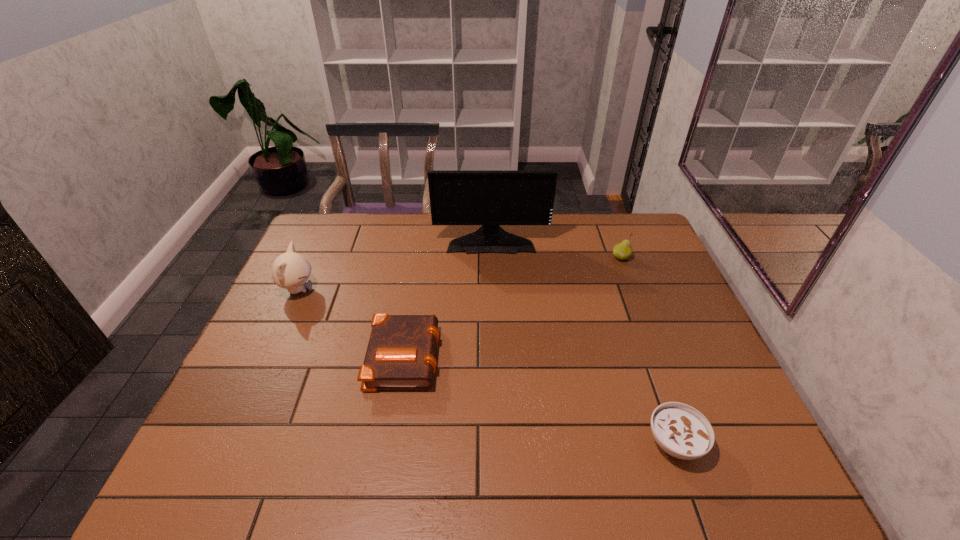
Find the location of `free space in the image that satisfies the following two spatial constraints: 1. on the screen side of the nearest object; 2. on the right side of the monitor`. free space in the image that satisfies the following two spatial constraints: 1. on the screen side of the nearest object; 2. on the right side of the monitor is located at coordinates (497, 442).

This screenshot has width=960, height=540. Find the location of `vacant space that satisfies the following two spatial constraints: 1. on the front side of the third tallest object; 2. on the spine side of the second nearest object`. vacant space that satisfies the following two spatial constraints: 1. on the front side of the third tallest object; 2. on the spine side of the second nearest object is located at coordinates (659, 355).

This screenshot has height=540, width=960. Find the location of `free space that satisfies the following two spatial constraints: 1. on the screen side of the tallest object; 2. on the face of the kitten`. free space that satisfies the following two spatial constraints: 1. on the screen side of the tallest object; 2. on the face of the kitten is located at coordinates (492, 290).

Locate an element on the screen. The height and width of the screenshot is (540, 960). vacant point that satisfies the following two spatial constraints: 1. on the screen side of the tallest object; 2. on the spine side of the fourth farthest object is located at coordinates (494, 355).

What are the coordinates of `vacant space that satisfies the following two spatial constraints: 1. on the screen side of the soup bowl; 2. on the right side of the monitor` in the screenshot? It's located at [x=497, y=442].

This screenshot has width=960, height=540. I want to click on vacant space that satisfies the following two spatial constraints: 1. on the back side of the nearest object; 2. on the left side of the pear, so click(610, 258).

The height and width of the screenshot is (540, 960). Find the location of `free space in the image that satisfies the following two spatial constraints: 1. on the screen side of the tallest object; 2. on the face of the kitten`. free space in the image that satisfies the following two spatial constraints: 1. on the screen side of the tallest object; 2. on the face of the kitten is located at coordinates (492, 290).

You are a GUI agent. You are given a task and a screenshot of the screen. Output one action in this format:
    pyautogui.click(x=<x>, y=<y>)
    Task: Click on the vacant area that satisfies the following two spatial constraints: 1. on the screen side of the tallest object; 2. on the face of the kitten
    The width and height of the screenshot is (960, 540).
    Given the screenshot: What is the action you would take?
    pyautogui.click(x=492, y=290)

Identify the location of vacant region that satisfies the following two spatial constraints: 1. on the screen side of the monitor; 2. on the right side of the third shortest object. (492, 258).